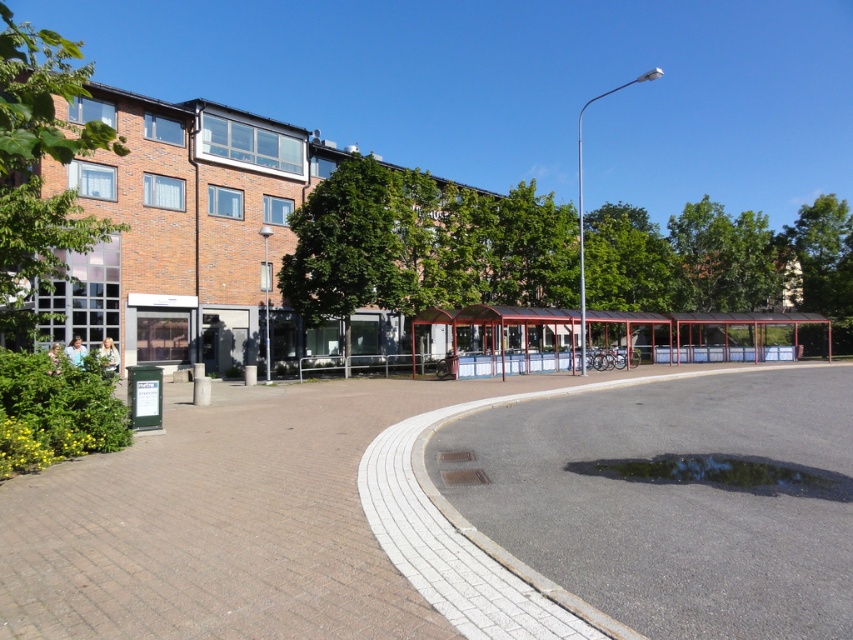
Does brick pavement at lower left have a larger size compared to metallic red bus stop at center?

No, brick pavement at lower left is not bigger than metallic red bus stop at center.

This screenshot has height=640, width=853. I want to click on brick pavement at lower left, so click(228, 520).

Does metallic red bus stop at center appear over transparent wet asphalt at lower center?

Yes, metallic red bus stop at center is above transparent wet asphalt at lower center.

Does metallic red bus stop at center come in front of transparent wet asphalt at lower center?

No, metallic red bus stop at center is further to the viewer.

Who is more distant from viewer, (699, 340) or (703, 476)?

The point (699, 340) is more distant.

You are a GUI agent. You are given a task and a screenshot of the screen. Output one action in this format:
    pyautogui.click(x=<x>, y=<y>)
    Task: Click on the metallic red bus stop at center
    
    Given the screenshot: What is the action you would take?
    pyautogui.click(x=706, y=333)

Does brick pavement at lower left have a greater height compared to transparent wet asphalt at lower center?

Yes.

Is point (271, 596) in front of point (776, 474)?

Yes, point (271, 596) is in front of point (776, 474).

Does point (436, 403) come closer to viewer compared to point (808, 470)?

No.

Where is `brick pavement at lower left`? brick pavement at lower left is located at coordinates (228, 520).